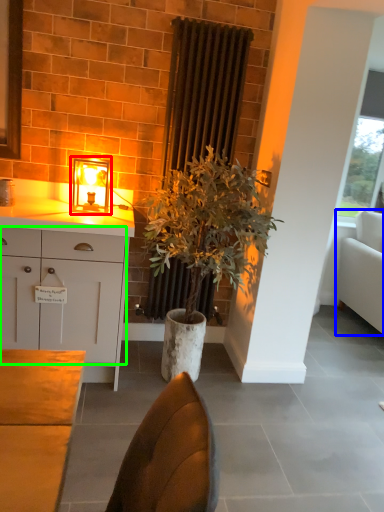
Question: Which object is the closest to the table lamp (highlighted by a red box)? Choose among these: studio couch (highlighted by a blue box) or cabinetry (highlighted by a green box).

Choices:
 (A) studio couch
 (B) cabinetry

Answer: (B)